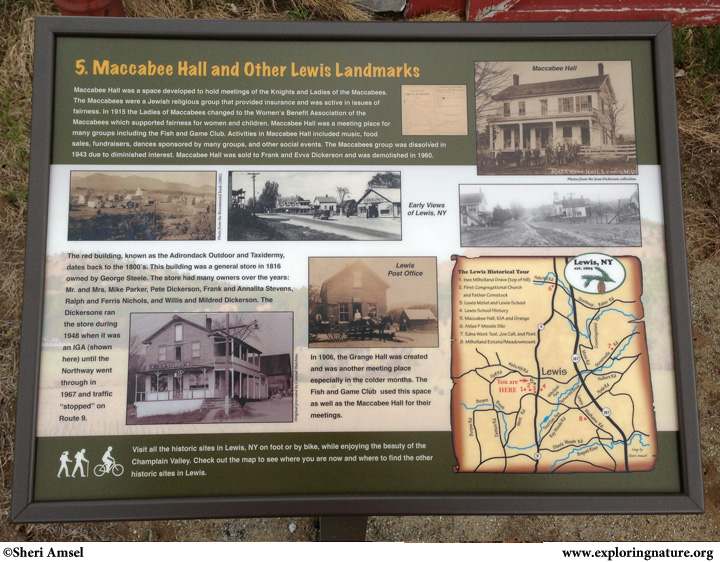
Locate an element on the screen. The width and height of the screenshot is (720, 562). border of the frame holding the sign is located at coordinates (690, 426), (374, 505), (27, 276), (361, 26).